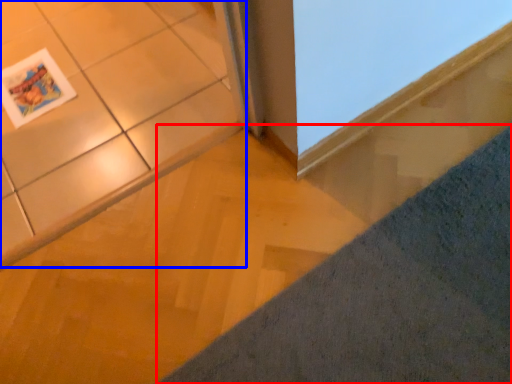
Question: Among these objects, which one is nearest to the camera, concrete (highlighted by a red box) or ceramic tile (highlighted by a blue box)?

Choices:
 (A) concrete
 (B) ceramic tile

Answer: (A)